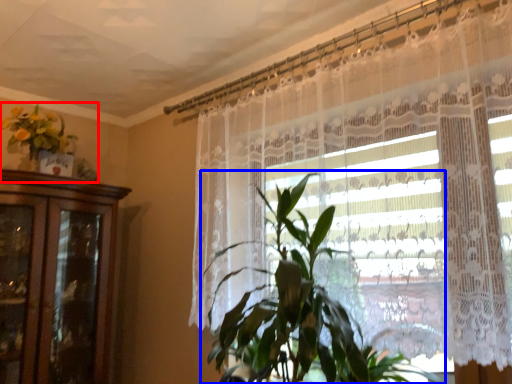
Question: Which object is further to the camera taking this photo, floral arrangement (highlighted by a red box) or houseplant (highlighted by a blue box)?

Choices:
 (A) floral arrangement
 (B) houseplant

Answer: (A)